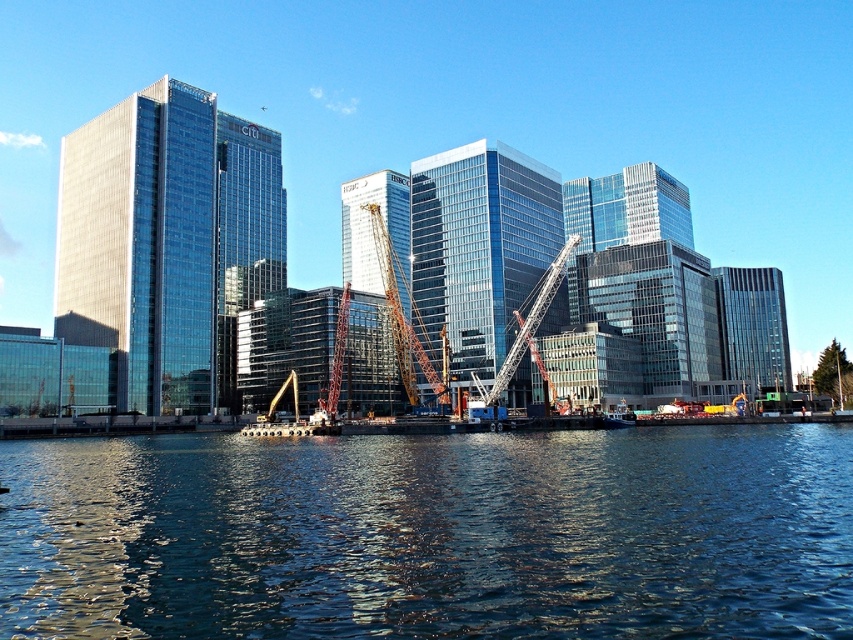
Does glassy reflective skyscraper at center have a greater height compared to glassy reflective building at right?

Correct, glassy reflective skyscraper at center is much taller as glassy reflective building at right.

Does glassy reflective skyscraper at center have a lesser height compared to glassy reflective building at right?

No.

Does point (480, 177) come closer to viewer compared to point (747, 349)?

Yes, point (480, 177) is in front of point (747, 349).

The image size is (853, 640). Identify the location of glassy reflective skyscraper at center. (479, 244).

Is the position of glassy steel tower at center less distant than that of yellow metallic crane at center?

No, it is not.

Who is more distant from viewer, (386, 284) or (405, 280)?

The point (405, 280) is behind.

I want to click on glassy steel tower at center, so click(x=376, y=234).

Can you confirm if dark blue water at lower center is positioned to the left of yellow metallic crane at center?

Incorrect, dark blue water at lower center is not on the left side of yellow metallic crane at center.

Who is more distant from viewer, (321, 483) or (434, 380)?

Point (434, 380)

Image resolution: width=853 pixels, height=640 pixels. Find the location of `dark blue water at lower center`. dark blue water at lower center is located at coordinates (431, 534).